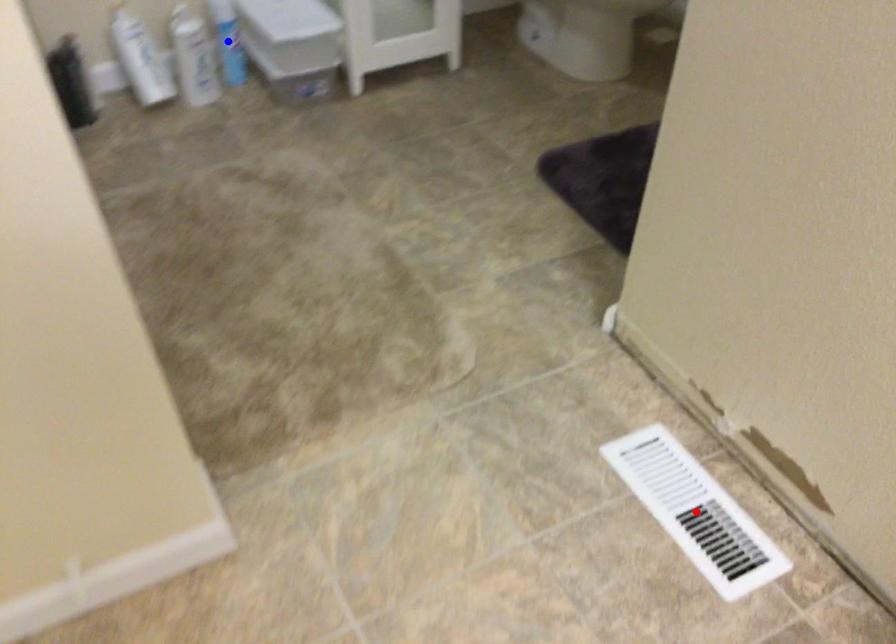
Question: Two points are marked on the image. Which point is closer to the camera?

Choices:
 (A) Blue point is closer.
 (B) Red point is closer.

Answer: (B)